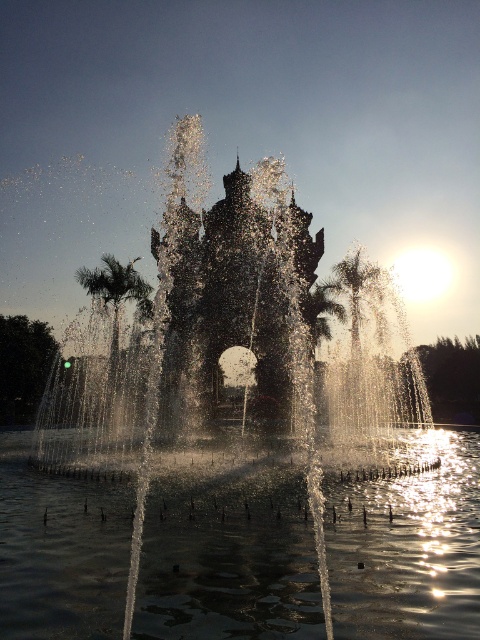
Question: In this image, where is clear liquid water at center located relative to green leafy palm tree at left?

Choices:
 (A) below
 (B) above

Answer: (A)

Question: Which object is closer to the camera taking this photo?

Choices:
 (A) clear liquid water at center
 (B) green leafy palm tree at left

Answer: (A)

Question: Does clear liquid water at center have a greater width compared to green leafy palm tree at left?

Choices:
 (A) yes
 (B) no

Answer: (A)

Question: Can you confirm if clear liquid water at center is positioned to the left of green leafy palm tree at left?

Choices:
 (A) no
 (B) yes

Answer: (A)